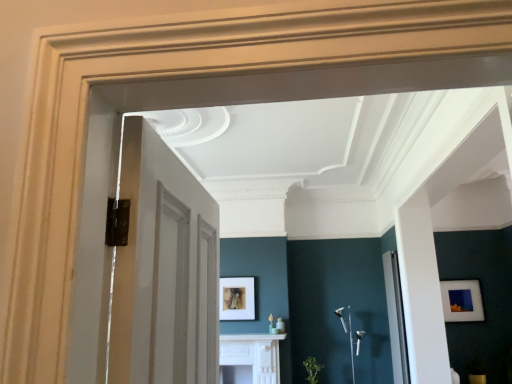
Question: From a real-world perspective, relative to green leafy plant at lower center, is matte gold picture frame at center, which ranks as the 2th picture frame in right-to-left order, vertically above or below?

Choices:
 (A) above
 (B) below

Answer: (A)

Question: Is matte gold picture frame at center, the first picture frame viewed from the left, bigger or smaller than green leafy plant at lower center?

Choices:
 (A) big
 (B) small

Answer: (B)

Question: Which of these objects is positioned farthest from the green leafy plant at lower center?

Choices:
 (A) matte gold picture frame at center, the first picture frame viewed from the left
 (B) white glossy fireplace at center
 (C) matte white picture frame at right, which is the second picture frame from left to right
 (D) clear glass door at right

Answer: (C)

Question: Considering the real-world distances, which object is closest to the white glossy fireplace at center?

Choices:
 (A) green leafy plant at lower center
 (B) clear glass door at right
 (C) matte white picture frame at right, which is the second picture frame from left to right
 (D) matte gold picture frame at center, which ranks as the 2th picture frame in right-to-left order

Answer: (D)